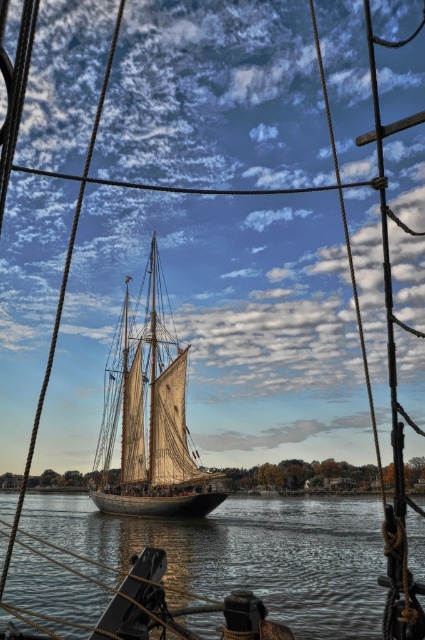
You are standing on the deck of the ship and looking through the rigging. There are two points marked on the rigging ropes. The first point is at coordinates point (340, 589) and the second point is at point (212, 484). Which point is physically closer to your eyes?

Point (340, 589) is closer to the camera than point (212, 484), so the first point is closer to your eyes.

You are a sailor on a ship and you want to look at the clear water at center and the wooden sailboat at center. Which one is closer to you from your current position in the rigging?

The clear water at center is closer to you because it is in front of the wooden sailboat at center from your vantage point in the rigging.